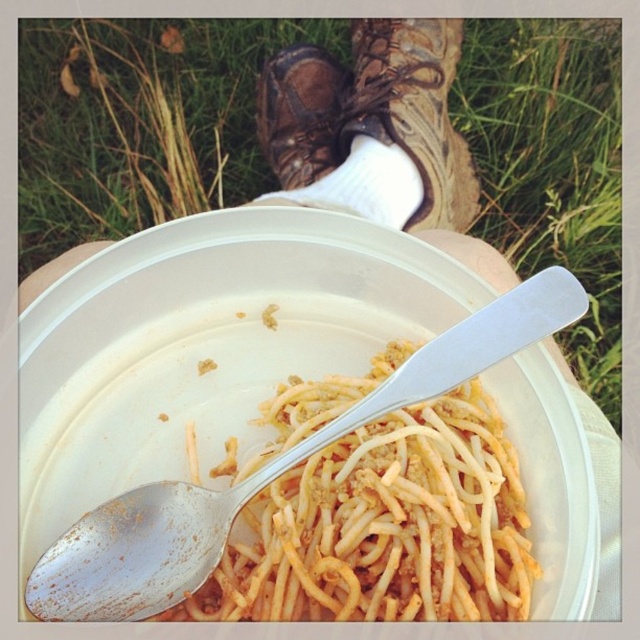
Between white plastic bowl at center and leather boot at center, which one appears on the left side from the viewer's perspective?

From the viewer's perspective, white plastic bowl at center appears more on the left side.

Does point (189, 284) come closer to viewer compared to point (401, 26)?

Yes, it is.

Is point (419, 296) positioned before point (365, 48)?

Yes, point (419, 296) is in front of point (365, 48).

At what (x,y) coordinates should I click in order to perform the action: click on white plastic bowl at center. Please return your answer as a coordinate pair (x, y). Image resolution: width=640 pixels, height=640 pixels. Looking at the image, I should click on (234, 282).

Does yellowish matte pasta at center lie behind white plastic bowl at center?

No, it is not.

From the picture: Is yellowish matte pasta at center taller than white plastic bowl at center?

In fact, yellowish matte pasta at center may be shorter than white plastic bowl at center.

Where is `yellowish matte pasta at center`? The height and width of the screenshot is (640, 640). yellowish matte pasta at center is located at coordinates (387, 528).

Who is higher up, leather boot at center or brown leather boot at upper center?

brown leather boot at upper center

Describe the element at coordinates (412, 109) in the screenshot. I see `leather boot at center` at that location.

Between point (460, 29) and point (312, 74), which one is positioned in front?

Positioned in front is point (312, 74).

Image resolution: width=640 pixels, height=640 pixels. I want to click on leather boot at center, so click(x=412, y=109).